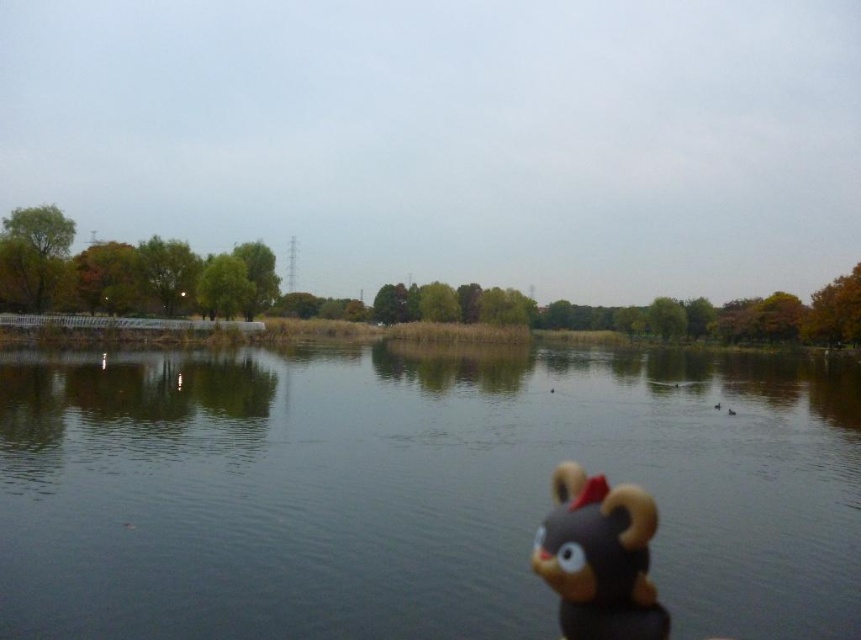
You are a photographer trying to capture the entire scene of the transparent water at center and the brown matte plush toy at lower right in one frame. Based on their sizes, which object will occupy more of the camera view?

The transparent water at center will occupy more of the camera view because its width is larger than that of the brown matte plush toy at lower right.

You are a photographer trying to capture the brown matte plush toy at lower right and the transparent water at center in the same frame. Based on their positions, which object should you focus on first if you want both to be in focus?

The brown matte plush toy at lower right is positioned above the transparent water at center. To have both in focus, you should focus on the brown matte plush toy at lower right first, as it is closer to the camera.